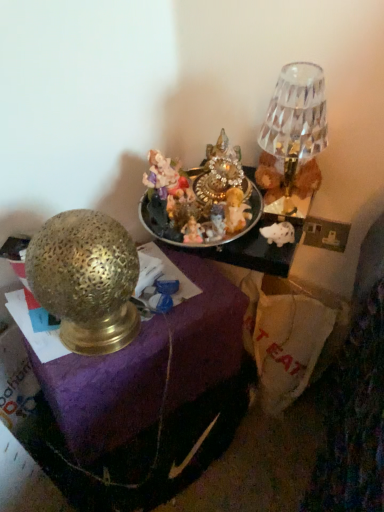
Locate an element on the screen. This screenshot has height=512, width=384. shiny metallic tray at center is located at coordinates (210, 241).

At what (x,y) coordinates should I click in order to perform the action: click on crystal glass lampshade at upper right, arranged as the second lamp when viewed from the left. Please return your answer as a coordinate pair (x, y). This screenshot has width=384, height=512. Looking at the image, I should click on (295, 122).

This screenshot has width=384, height=512. Identify the location of shiny metallic tray at center. (210, 241).

I want to click on furniture that is below the gold textured lamp at left, acting as the first lamp starting from the left (from the image's perspective), so click(x=137, y=405).

From a real-world perspective, is gold textured lamp at left, the first lamp in the bottom-to-top sequence, on top of gold textured lamp at left?

Yes, from a real-world perspective, gold textured lamp at left, the first lamp in the bottom-to-top sequence, is on top of gold textured lamp at left.

Is point (80, 331) behind point (203, 356)?

No, (80, 331) is closer to viewer.

Is point (226, 239) farther from camera compared to point (70, 220)?

That is True.

How much distance is there between shiny metallic tray at center and gold textured lamp at left, the 2th lamp viewed from the top?

They are 7.02 inches apart.

Is shiny metallic tray at center positioned beyond the bounds of gold textured lamp at left, positioned as the second lamp in right-to-left order?

Yes, shiny metallic tray at center is not within gold textured lamp at left, positioned as the second lamp in right-to-left order.

Is shiny metallic tray at center to the left of gold textured lamp at left, the first lamp in the bottom-to-top sequence, from the viewer's perspective?

No, shiny metallic tray at center is not to the left of gold textured lamp at left, the first lamp in the bottom-to-top sequence.

How different are the orientations of gold textured lamp at left and crystal glass lampshade at upper right, arranged as the second lamp when viewed from the left, in degrees?

54.8 degrees.

Is gold textured lamp at left aimed at crystal glass lampshade at upper right, the first lamp in the right-to-left sequence?

No, gold textured lamp at left is not oriented towards crystal glass lampshade at upper right, the first lamp in the right-to-left sequence.

Between point (93, 396) and point (293, 124), which one is positioned in front?

The point (293, 124) is more forward.

Is gold textured lamp at left in front of crystal glass lampshade at upper right, the second lamp positioned from the bottom?

Yes, the depth of gold textured lamp at left is less than that of crystal glass lampshade at upper right, the second lamp positioned from the bottom.

Is gold textured lamp at left, acting as the first lamp starting from the left, turned away from shiny metallic tray at center?

Yes, gold textured lamp at left, acting as the first lamp starting from the left, is positioned with its back facing shiny metallic tray at center.

Looking at this image, from the image's perspective, who appears lower, gold textured lamp at left, acting as the first lamp starting from the left, or shiny metallic tray at center?

gold textured lamp at left, acting as the first lamp starting from the left, appears lower in the image.

Can you confirm if gold textured lamp at left, the 2th lamp viewed from the top, is wider than shiny metallic tray at center?

No, gold textured lamp at left, the 2th lamp viewed from the top, is not wider than shiny metallic tray at center.

This screenshot has height=512, width=384. In the image, there is a shiny metallic tray at center. What are the coordinates of `lamp below it (from the image's perspective)` in the screenshot? It's located at (86, 280).

Does point (61, 329) appear closer or farther from the camera than point (305, 78)?

Point (61, 329) is farther from the camera than point (305, 78).

Which object is wider, gold textured lamp at left, the 2th lamp viewed from the top, or crystal glass lampshade at upper right, the first lamp in the right-to-left sequence?

Wider between the two is gold textured lamp at left, the 2th lamp viewed from the top.

Is gold textured lamp at left, positioned as the second lamp in right-to-left order, to the left of crystal glass lampshade at upper right, arranged as the first lamp when viewed from the top, from the viewer's perspective?

Indeed, gold textured lamp at left, positioned as the second lamp in right-to-left order, is positioned on the left side of crystal glass lampshade at upper right, arranged as the first lamp when viewed from the top.

Is crystal glass lampshade at upper right, the second lamp positioned from the bottom, surrounding gold textured lamp at left, the first lamp in the bottom-to-top sequence?

Actually, gold textured lamp at left, the first lamp in the bottom-to-top sequence, is outside crystal glass lampshade at upper right, the second lamp positioned from the bottom.

From the picture: Which of these two, crystal glass lampshade at upper right, arranged as the first lamp when viewed from the top, or gold textured lamp at left, positioned as the second lamp in right-to-left order, is thinner?

crystal glass lampshade at upper right, arranged as the first lamp when viewed from the top, is thinner.

Is crystal glass lampshade at upper right, the first lamp in the right-to-left sequence, directly adjacent to gold textured lamp at left, the first lamp in the bottom-to-top sequence?

No, crystal glass lampshade at upper right, the first lamp in the right-to-left sequence, is not next to gold textured lamp at left, the first lamp in the bottom-to-top sequence.

Is crystal glass lampshade at upper right, the first lamp in the right-to-left sequence, to the left or to the right of gold textured lamp at left, the 2th lamp viewed from the top, in the image?

In the image, crystal glass lampshade at upper right, the first lamp in the right-to-left sequence, appears on the right side of gold textured lamp at left, the 2th lamp viewed from the top.

Which is in front, shiny metallic tray at center or gold textured lamp at left?

Positioned in front is gold textured lamp at left.

From the image's perspective, is shiny metallic tray at center located beneath gold textured lamp at left?

No, from the image's perspective, shiny metallic tray at center is not beneath gold textured lamp at left.

Identify the location of furniture that is on the left side of shiny metallic tray at center. (137, 405).

Who is taller, shiny metallic tray at center or gold textured lamp at left?

Standing taller between the two is gold textured lamp at left.

Identify the location of furniture beneath the gold textured lamp at left, the 2th lamp viewed from the top (from a real-world perspective). Image resolution: width=384 pixels, height=512 pixels. (137, 405).

Identify the location of lamp below the shiny metallic tray at center (from the image's perspective). Image resolution: width=384 pixels, height=512 pixels. (86, 280).

In the scene shown: Estimate the real-world distances between objects in this image. Which object is closer to gold textured lamp at left, crystal glass lampshade at upper right, the second lamp positioned from the bottom, or gold textured lamp at left, positioned as the second lamp in right-to-left order?

gold textured lamp at left, positioned as the second lamp in right-to-left order.

Estimate the real-world distances between objects in this image. Which object is further from gold textured lamp at left, crystal glass lampshade at upper right, the first lamp in the right-to-left sequence, or shiny metallic tray at center?

crystal glass lampshade at upper right, the first lamp in the right-to-left sequence, is further to gold textured lamp at left.

Estimate the real-world distances between objects in this image. Which object is further from shiny metallic tray at center, crystal glass lampshade at upper right, the first lamp in the right-to-left sequence, or gold textured lamp at left, positioned as the second lamp in right-to-left order?

Based on the image, gold textured lamp at left, positioned as the second lamp in right-to-left order, appears to be further to shiny metallic tray at center.

Which object lies further to the anchor point crystal glass lampshade at upper right, arranged as the second lamp when viewed from the left, gold textured lamp at left, the first lamp in the bottom-to-top sequence, or gold textured lamp at left?

The object further to crystal glass lampshade at upper right, arranged as the second lamp when viewed from the left, is gold textured lamp at left.

Which object lies nearer to the anchor point gold textured lamp at left, shiny metallic tray at center or gold textured lamp at left, acting as the first lamp starting from the left?

gold textured lamp at left, acting as the first lamp starting from the left, is closer to gold textured lamp at left.

Looking at this image, when comparing their distances from gold textured lamp at left, acting as the first lamp starting from the left, does shiny metallic tray at center or crystal glass lampshade at upper right, the second lamp positioned from the bottom, seem closer?

shiny metallic tray at center.

Based on their spatial positions, is gold textured lamp at left or shiny metallic tray at center closer to gold textured lamp at left, the first lamp in the bottom-to-top sequence?

shiny metallic tray at center.

Considering their positions, is gold textured lamp at left, the first lamp in the bottom-to-top sequence, positioned further to shiny metallic tray at center than gold textured lamp at left?

gold textured lamp at left is positioned further to the anchor shiny metallic tray at center.

The height and width of the screenshot is (512, 384). Identify the location of tableware situated between gold textured lamp at left, the first lamp in the bottom-to-top sequence, and crystal glass lampshade at upper right, the first lamp in the right-to-left sequence, from left to right. (210, 241).

This screenshot has width=384, height=512. I want to click on tableware between crystal glass lampshade at upper right, arranged as the second lamp when viewed from the left, and gold textured lamp at left in the up-down direction, so click(x=210, y=241).

Where is `lamp between crystal glass lampshade at upper right, arranged as the second lamp when viewed from the left, and gold textured lamp at left in the up-down direction`? This screenshot has height=512, width=384. lamp between crystal glass lampshade at upper right, arranged as the second lamp when viewed from the left, and gold textured lamp at left in the up-down direction is located at coordinates (86, 280).

At what (x,y) coordinates should I click in order to perform the action: click on lamp between shiny metallic tray at center and gold textured lamp at left from top to bottom. Please return your answer as a coordinate pair (x, y). This screenshot has height=512, width=384. Looking at the image, I should click on (86, 280).